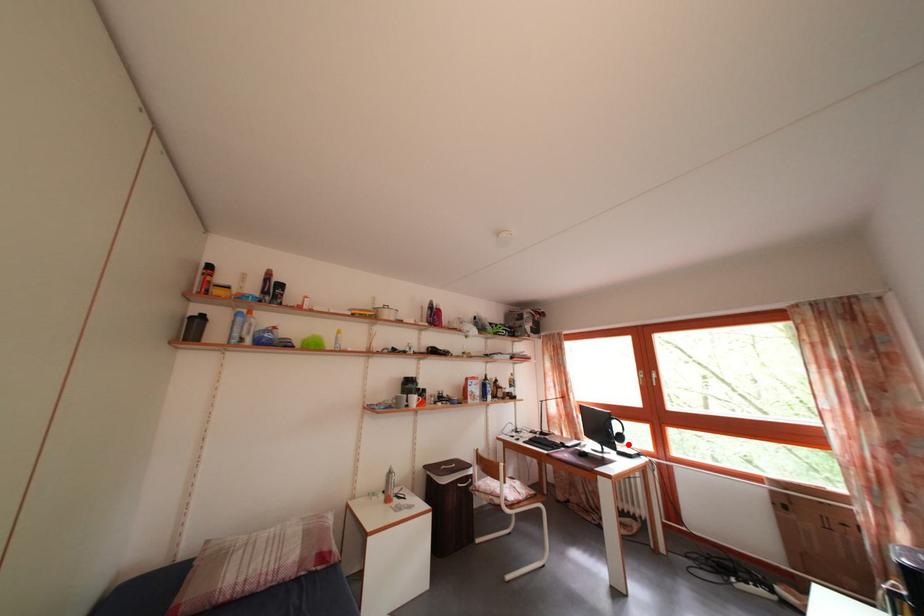
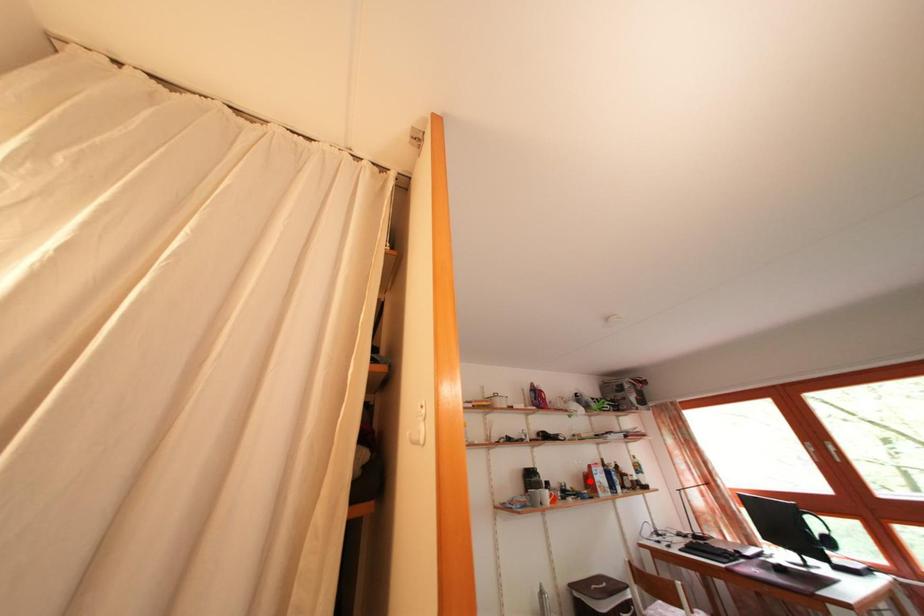
I am providing you with two images of the same scene from different viewpoints. A red point is marked on the first image and another point is marked on the second image. Does the point marked in image1 correspond to the same location as the one in image2?

No